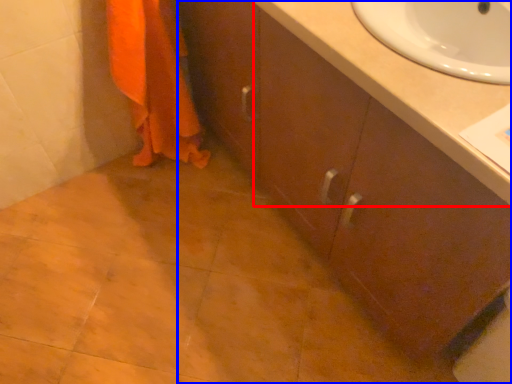
Question: Which object is closer to the camera taking this photo, counter top (highlighted by a red box) or bathroom cabinet (highlighted by a blue box)?

Choices:
 (A) counter top
 (B) bathroom cabinet

Answer: (B)